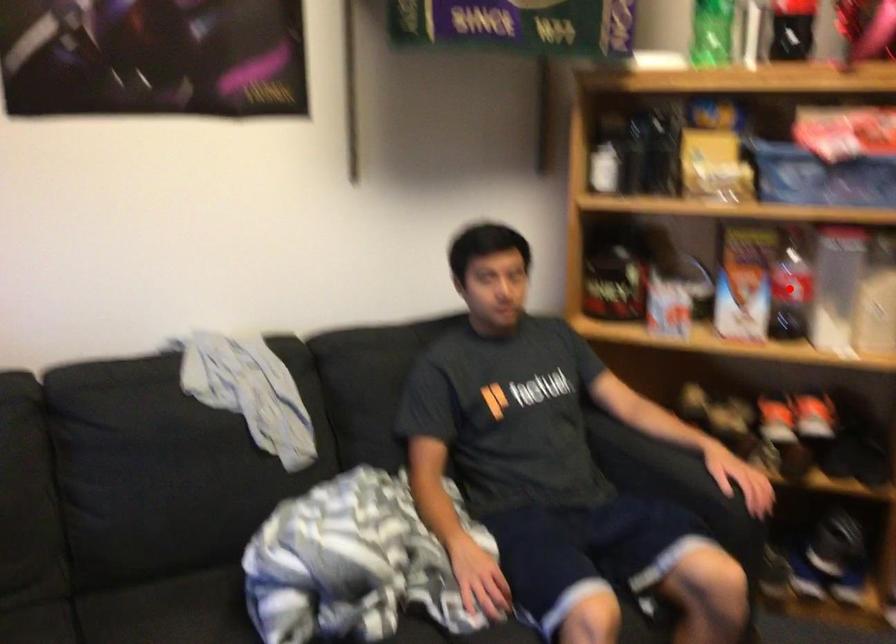
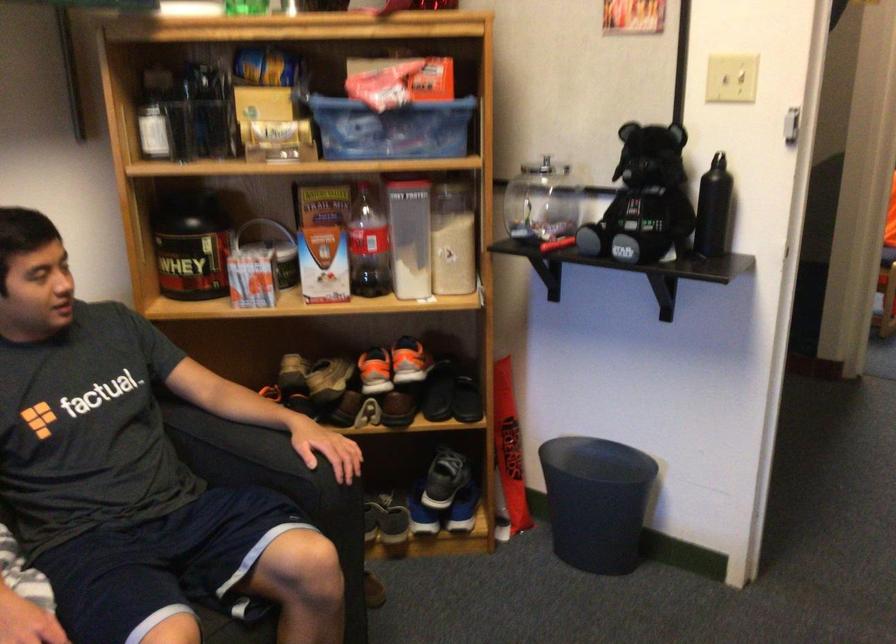
Locate, in the second image, the point that corresponds to the highlighted location in the first image.

(367, 245)